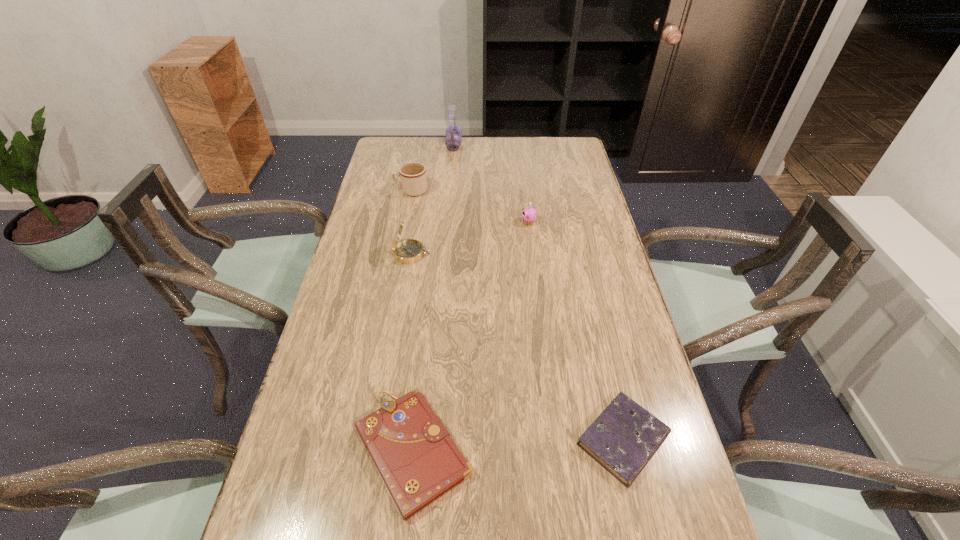
The height and width of the screenshot is (540, 960). I want to click on free space that is in between the headset and the diary, so click(539, 293).

At what (x,y) coordinates should I click in order to perform the action: click on vacant point located between the compass and the notebook. Please return your answer as a coordinate pair (x, y). Looking at the image, I should click on (412, 353).

This screenshot has height=540, width=960. Find the location of `unoccupied position between the cupcake and the diary`. unoccupied position between the cupcake and the diary is located at coordinates (576, 331).

Where is `free spot between the notebook and the cupcake`? This screenshot has width=960, height=540. free spot between the notebook and the cupcake is located at coordinates (470, 336).

Image resolution: width=960 pixels, height=540 pixels. I want to click on free space that is in between the notebook and the tallest object, so click(433, 298).

Identify the location of unoccupied position between the notebook and the fifth object from left to right. (470, 336).

You are a GUI agent. You are given a task and a screenshot of the screen. Output one action in this format:
    pyautogui.click(x=<x>, y=<y>)
    Task: Click on the unoccupied area between the mug and the headset
    This screenshot has height=540, width=960.
    Given the screenshot: What is the action you would take?
    pyautogui.click(x=432, y=168)

You are a GUI agent. You are given a task and a screenshot of the screen. Output one action in this format:
    pyautogui.click(x=<x>, y=<y>)
    Task: Click on the object that stands as the closest to the third nearest object
    The width and height of the screenshot is (960, 540).
    Given the screenshot: What is the action you would take?
    pyautogui.click(x=413, y=178)

I want to click on the third closest object relative to the mug, so click(529, 214).

Identify the location of vacant region that satisfies the following two spatial constraints: 1. with the dial facing the second shortest object; 2. on the left side of the fifth shortest object. The height and width of the screenshot is (540, 960). (378, 451).